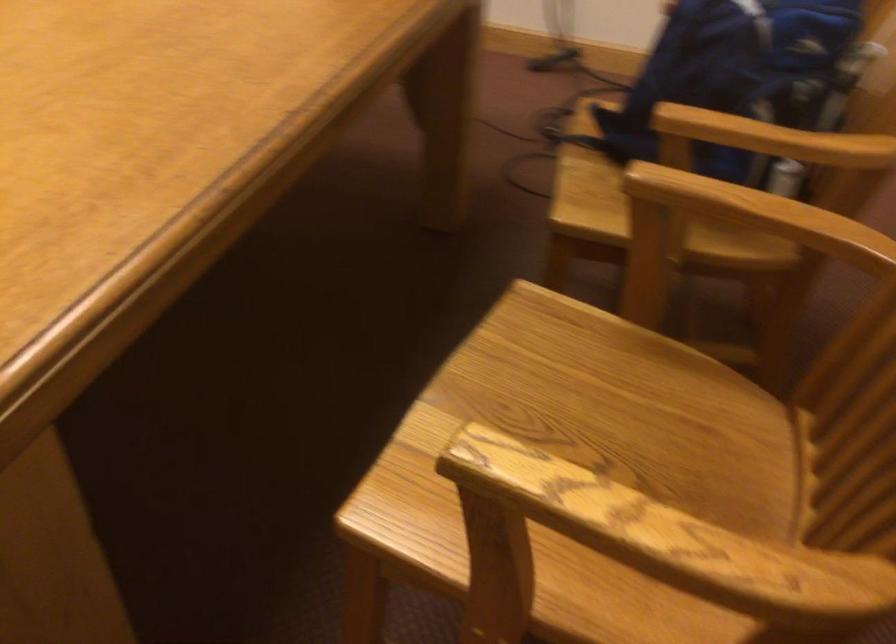
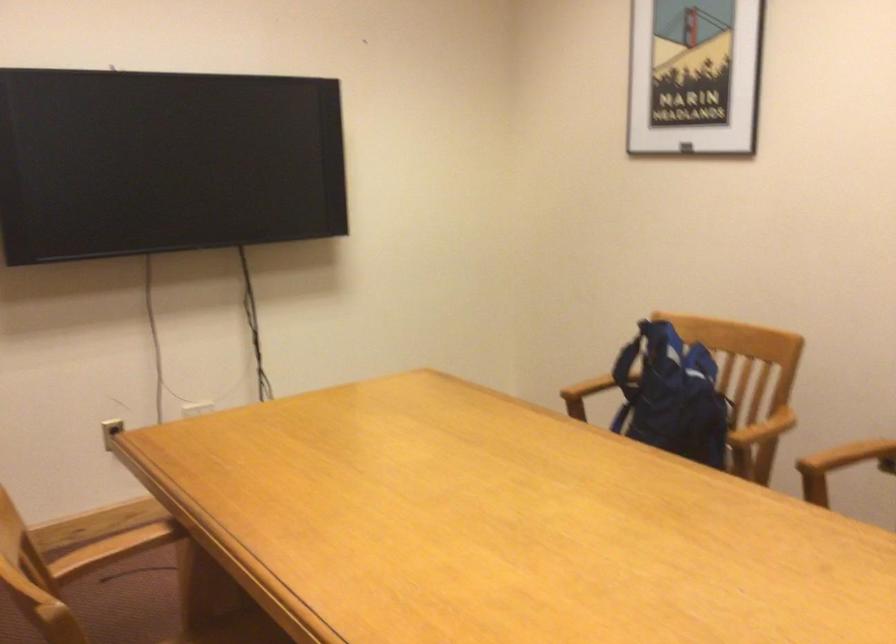
Find the pixel in the second image that matches pixel 780 221 in the first image.

(849, 456)